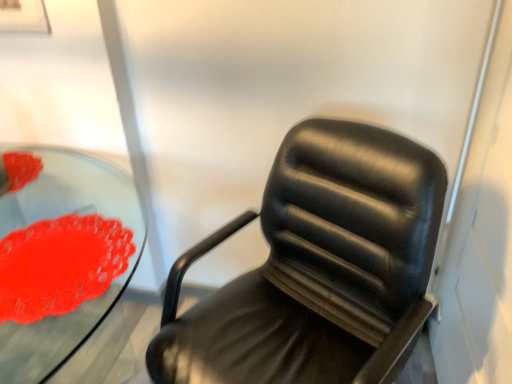
Question: Does black leather chair at center lie in front of transparent glass table at center?

Choices:
 (A) yes
 (B) no

Answer: (A)

Question: Does black leather chair at center have a greater height compared to transparent glass table at center?

Choices:
 (A) yes
 (B) no

Answer: (A)

Question: Can you confirm if black leather chair at center is thinner than transparent glass table at center?

Choices:
 (A) yes
 (B) no

Answer: (A)

Question: Does black leather chair at center have a lesser height compared to transparent glass table at center?

Choices:
 (A) no
 (B) yes

Answer: (A)

Question: Is black leather chair at center beside transparent glass table at center?

Choices:
 (A) yes
 (B) no

Answer: (B)

Question: Considering the relative positions of transparent glass table at center and rubberized red flower at left in the image provided, is transparent glass table at center to the left or to the right of rubberized red flower at left?

Choices:
 (A) right
 (B) left

Answer: (B)

Question: Which is correct: transparent glass table at center is inside rubberized red flower at left, or outside of it?

Choices:
 (A) outside
 (B) inside

Answer: (A)

Question: In terms of height, does transparent glass table at center look taller or shorter compared to rubberized red flower at left?

Choices:
 (A) short
 (B) tall

Answer: (B)

Question: From a real-world perspective, is transparent glass table at center physically located above or below rubberized red flower at left?

Choices:
 (A) below
 (B) above

Answer: (A)

Question: From a real-world perspective, relative to transparent glass table at center, is black leather chair at center vertically above or below?

Choices:
 (A) above
 (B) below

Answer: (A)

Question: Is black leather chair at center wider or thinner than transparent glass table at center?

Choices:
 (A) thin
 (B) wide

Answer: (A)

Question: Considering the positions of point (298, 306) and point (20, 349), is point (298, 306) closer or farther from the camera than point (20, 349)?

Choices:
 (A) closer
 (B) farther

Answer: (A)

Question: Considering their positions, is black leather chair at center located in front of or behind transparent glass table at center?

Choices:
 (A) behind
 (B) front

Answer: (B)

Question: From a real-world perspective, is black leather chair at center above or below rubberized red flower at left?

Choices:
 (A) above
 (B) below

Answer: (B)

Question: Visually, is black leather chair at center positioned to the left or to the right of rubberized red flower at left?

Choices:
 (A) left
 (B) right

Answer: (B)